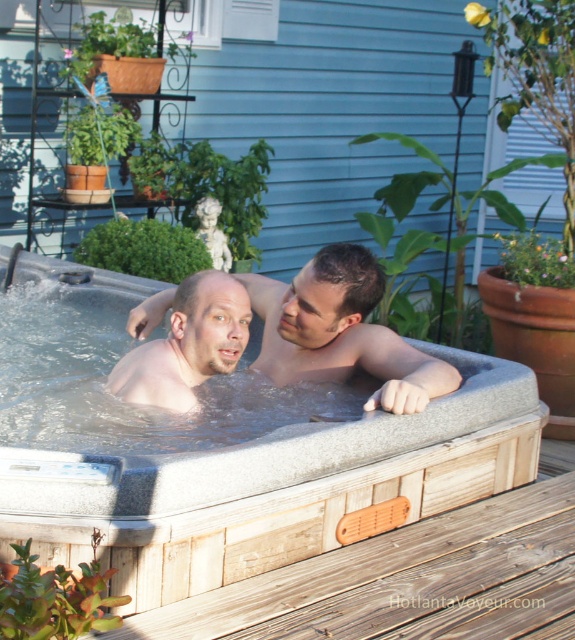
Does point (263, 544) lie behind point (198, 339)?

No.

Who is positioned more to the left, gray plastic hot tub at center or matte skin at center?

Positioned to the left is matte skin at center.

Between point (402, 472) and point (161, 371), which one is positioned in front?

Point (402, 472)

Find the location of a particular element. gray plastic hot tub at center is located at coordinates (273, 486).

Does wooden deck at lower right come behind matte skin at center?

That is False.

Is point (435, 548) closer to viewer compared to point (242, 317)?

Yes, point (435, 548) is in front of point (242, 317).

The width and height of the screenshot is (575, 640). I want to click on wooden deck at lower right, so 411,579.

Based on the photo, can you confirm if smooth skin man at center is positioned to the left of matte skin at center?

In fact, smooth skin man at center is to the right of matte skin at center.

Who is more distant from viewer, (x=427, y=381) or (x=147, y=342)?

The point (x=147, y=342) is more distant.

The image size is (575, 640). What do you see at coordinates (340, 332) in the screenshot?
I see `smooth skin man at center` at bounding box center [340, 332].

You are a GUI agent. You are given a task and a screenshot of the screen. Output one action in this format:
    pyautogui.click(x=<x>, y=<y>)
    Task: Click on the smooth skin man at center
    The image size is (575, 640).
    Given the screenshot: What is the action you would take?
    pyautogui.click(x=340, y=332)